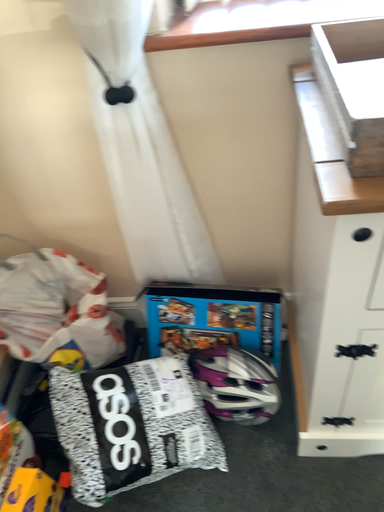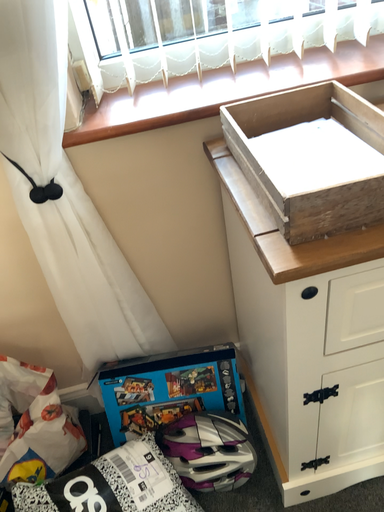
Question: Which way did the camera rotate in the video?

Choices:
 (A) rotated left
 (B) rotated right

Answer: (B)